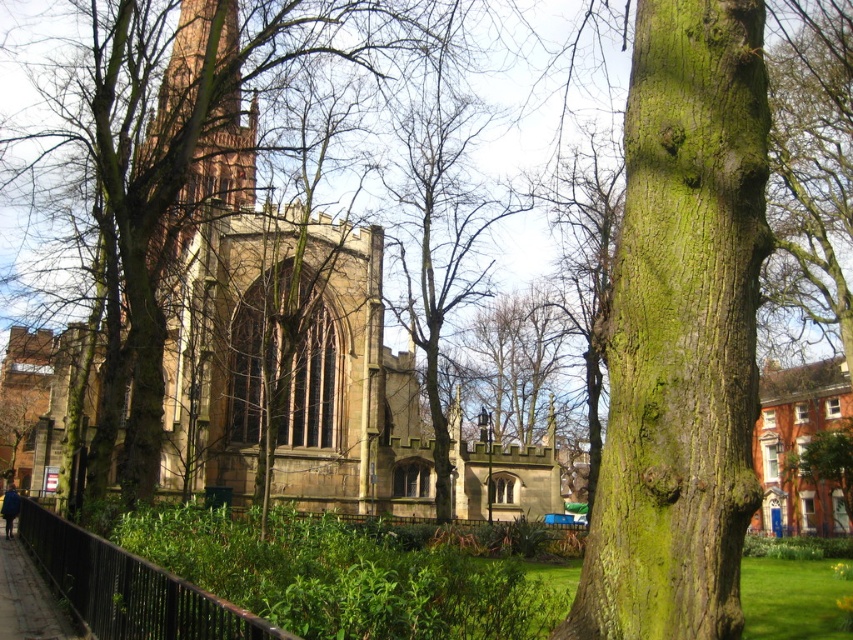
Question: Which point is closer to the camera taking this photo?

Choices:
 (A) (378, 465)
 (B) (637, 234)
 (C) (74, 611)
 (D) (12, 516)

Answer: (B)

Question: Considering the relative positions of black metal fence at lower left and dark gray concrete pavement at lower left in the image provided, where is black metal fence at lower left located with respect to dark gray concrete pavement at lower left?

Choices:
 (A) right
 (B) left

Answer: (A)

Question: Can you confirm if dark gray concrete pavement at lower left is bigger than blue fabric jacket at lower left?

Choices:
 (A) no
 (B) yes

Answer: (A)

Question: Among these objects, which one is farthest from the camera?

Choices:
 (A) black metal fence at lower left
 (B) dark gray concrete pavement at lower left
 (C) brown stone church at center

Answer: (C)

Question: Is green mossy bark tree at center wider than dark gray concrete pavement at lower left?

Choices:
 (A) yes
 (B) no

Answer: (B)

Question: Which point is farther from the camera taking this photo?

Choices:
 (A) (30, 502)
 (B) (374, 339)
 (C) (704, 484)
 (D) (4, 497)

Answer: (B)